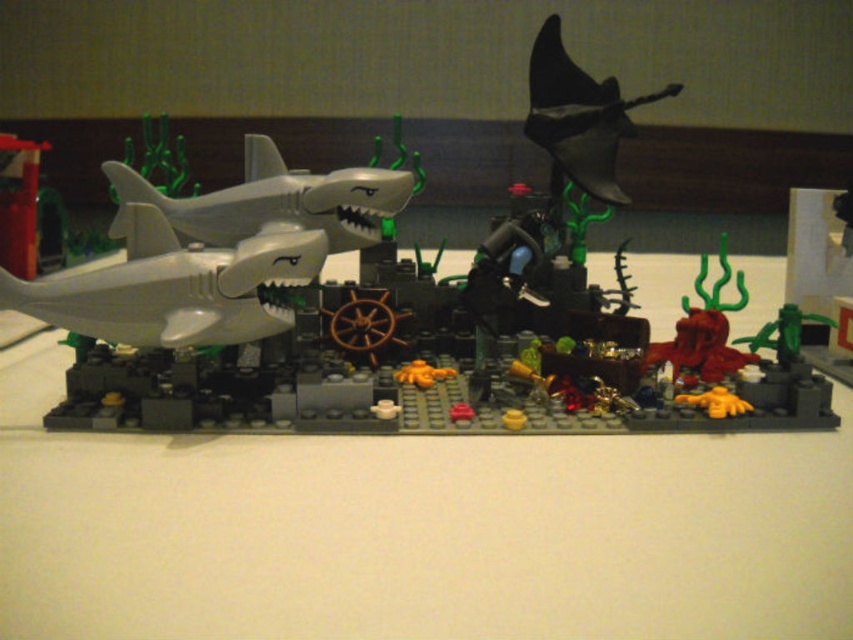
You are a LEGO pirate captain navigating through this underwater scene. You need to avoid the sharks to reach the treasure chest located behind the structure. Which shark should you avoid first, the matte gray shark at center or the white matte shark at left, based on their sizes?

The matte gray shark at center is larger in size than the white matte shark at left, so you should avoid the matte gray shark at center first as it poses a bigger threat.